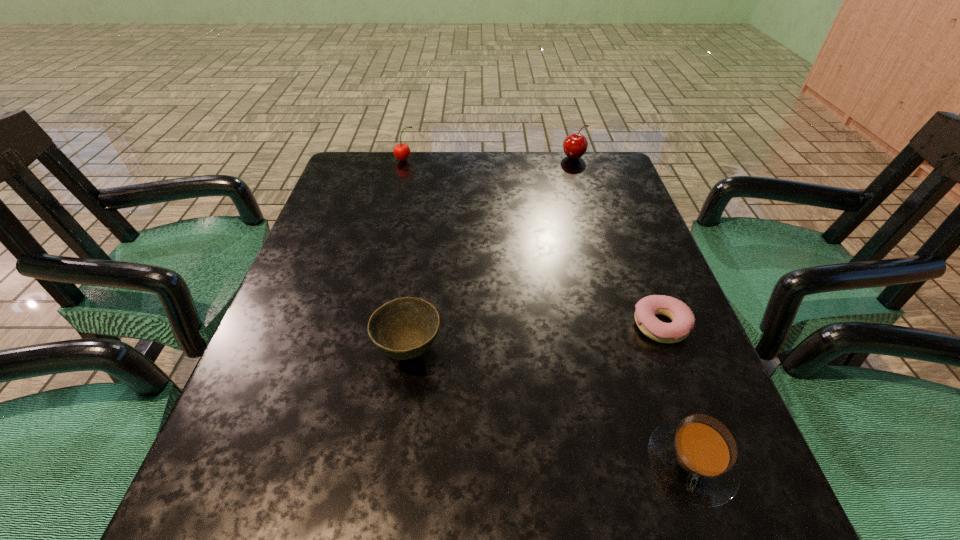
Identify the location of free space between the left cherry and the bowl. The width and height of the screenshot is (960, 540). (407, 255).

I want to click on vacant area between the right cherry and the shortest object, so click(x=617, y=241).

What are the coordinates of `vacant point located between the nearest object and the bowl` in the screenshot? It's located at (550, 407).

Image resolution: width=960 pixels, height=540 pixels. I want to click on empty space between the right cherry and the bowl, so click(x=492, y=254).

Locate an element on the screen. empty space between the cappuccino and the right cherry is located at coordinates (633, 310).

This screenshot has width=960, height=540. Find the location of `free space that is in between the right cherry and the left cherry`. free space that is in between the right cherry and the left cherry is located at coordinates (490, 159).

Identify which object is located as the second nearest to the second shortest object. Please provide its 2D coordinates. Your answer should be formatted as a tuple, i.e. [(x, y)], where the tuple contains the x and y coordinates of a point satisfying the conditions above.

[(404, 328)]

Identify which object is the nearest to the right cherry. Please provide its 2D coordinates. Your answer should be formatted as a tuple, i.e. [(x, y)], where the tuple contains the x and y coordinates of a point satisfying the conditions above.

[(401, 151)]

I want to click on vacant position in the image that satisfies the following two spatial constraints: 1. on the front side of the left cherry; 2. on the left side of the bowl, so click(x=359, y=350).